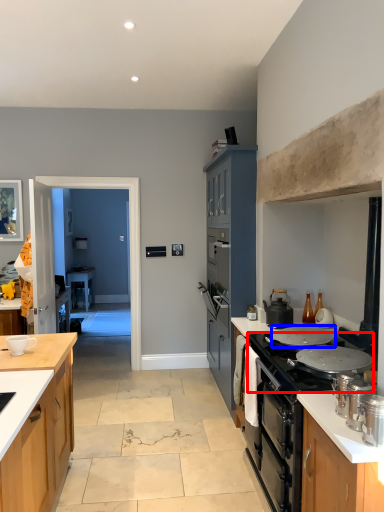
Question: Which point is closer to the camera, gas stove (highlighted by a red box) or pot/pan (highlighted by a blue box)?

Choices:
 (A) gas stove
 (B) pot/pan

Answer: (A)